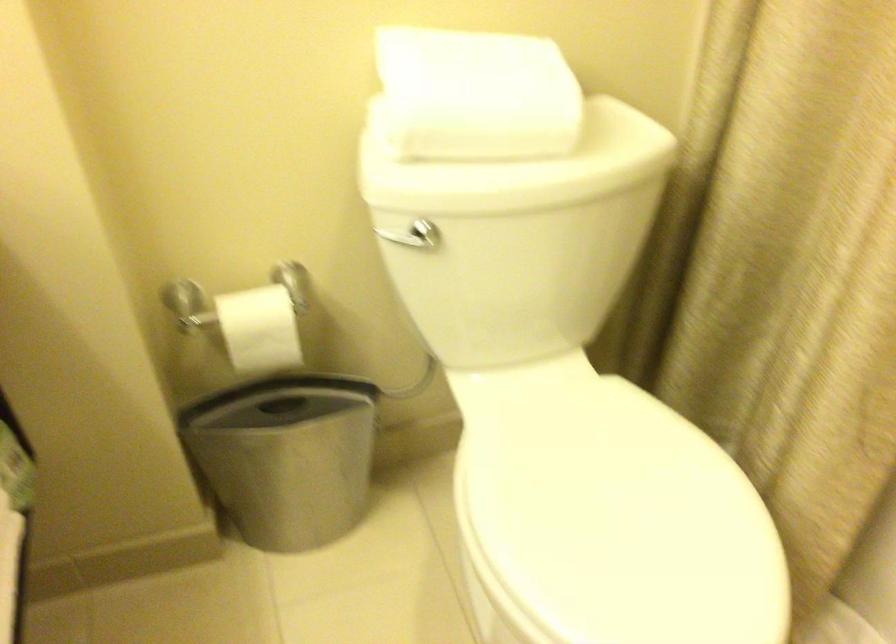
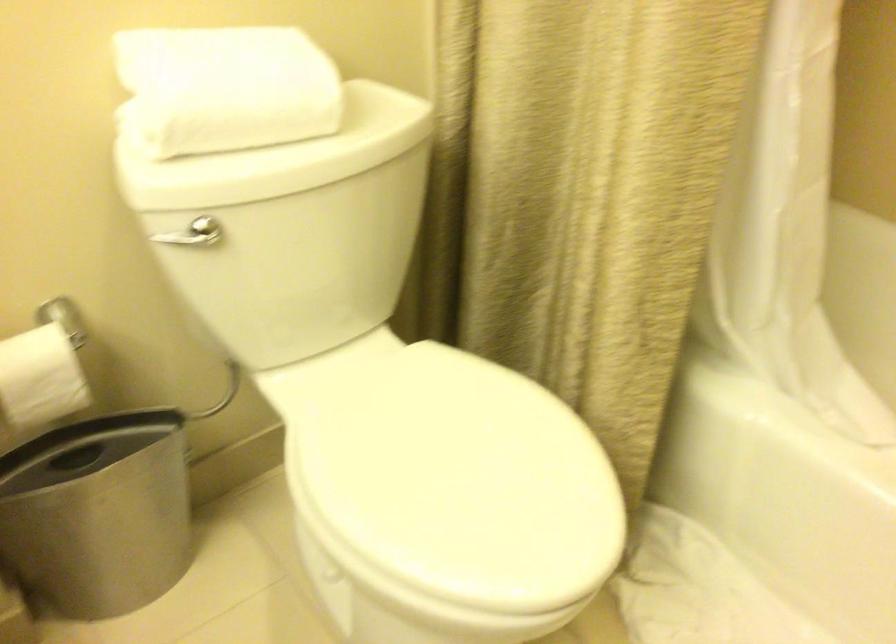
Locate, in the second image, the point that corresponds to pixel 286 464 in the first image.

(98, 514)